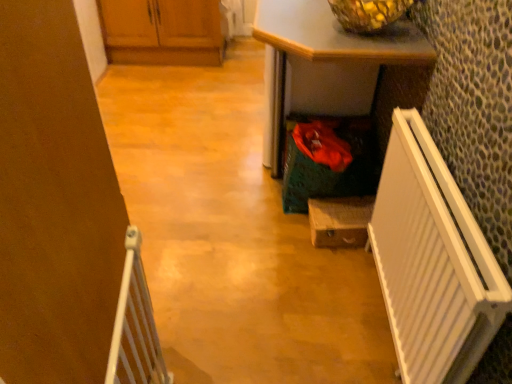
Question: Can you see wooden drawer at center, marked as the 2th cabinetry in a left-to-right arrangement, touching white plastic radiator at right, acting as the first radiator starting from the right?

Choices:
 (A) no
 (B) yes

Answer: (A)

Question: Is wooden drawer at center, which is the first cabinetry from bottom to top, bigger than white plastic radiator at right, acting as the first radiator starting from the right?

Choices:
 (A) no
 (B) yes

Answer: (A)

Question: Can you confirm if wooden drawer at center, which is counted as the 1th cabinetry, starting from the right, is thinner than white plastic radiator at right, acting as the first radiator starting from the right?

Choices:
 (A) no
 (B) yes

Answer: (A)

Question: From the image's perspective, does wooden drawer at center, which is counted as the 1th cabinetry, starting from the right, appear lower than white plastic radiator at right, the second radiator viewed from the left?

Choices:
 (A) yes
 (B) no

Answer: (B)

Question: Considering the relative sizes of wooden drawer at center, which is the first cabinetry from bottom to top, and white plastic radiator at right, the second radiator viewed from the left, in the image provided, is wooden drawer at center, which is the first cabinetry from bottom to top, shorter than white plastic radiator at right, the second radiator viewed from the left,?

Choices:
 (A) yes
 (B) no

Answer: (A)

Question: Considering the positions of wooden drawer at center, acting as the 1th cabinetry starting from the front, and green textured desk at center in the image, is wooden drawer at center, acting as the 1th cabinetry starting from the front, bigger or smaller than green textured desk at center?

Choices:
 (A) small
 (B) big

Answer: (A)

Question: Is wooden drawer at center, which is the second cabinetry in back-to-front order, to the left or to the right of green textured desk at center in the image?

Choices:
 (A) left
 (B) right

Answer: (B)

Question: Relative to green textured desk at center, is wooden drawer at center, marked as the 2th cabinetry in a left-to-right arrangement, in front or behind?

Choices:
 (A) behind
 (B) front

Answer: (A)

Question: From the image's perspective, is wooden drawer at center, which appears as the 2th cabinetry when viewed from the top, above or below green textured desk at center?

Choices:
 (A) below
 (B) above

Answer: (A)

Question: Choose the correct answer: Is wooden cabinets at upper left, which is the second cabinetry from front to back, inside green textured desk at center or outside it?

Choices:
 (A) outside
 (B) inside

Answer: (A)

Question: From the image's perspective, relative to green textured desk at center, is wooden cabinets at upper left, arranged as the 1th cabinetry when viewed from the left, above or below?

Choices:
 (A) below
 (B) above

Answer: (B)

Question: Visually, is wooden cabinets at upper left, which appears as the 2th cabinetry when viewed from the right, positioned to the left or to the right of green textured desk at center?

Choices:
 (A) left
 (B) right

Answer: (A)

Question: From a real-world perspective, relative to green textured desk at center, is wooden cabinets at upper left, marked as the 1th cabinetry in a top-to-bottom arrangement, vertically above or below?

Choices:
 (A) below
 (B) above

Answer: (A)

Question: Considering the positions of wooden cabinets at upper left, which appears as the 2th cabinetry when ordered from the bottom, and white plastic radiator at right, the second radiator viewed from the left, in the image, is wooden cabinets at upper left, which appears as the 2th cabinetry when ordered from the bottom, taller or shorter than white plastic radiator at right, the second radiator viewed from the left,?

Choices:
 (A) tall
 (B) short

Answer: (B)

Question: Looking at the image, does wooden cabinets at upper left, the 1th cabinetry when ordered from back to front, seem bigger or smaller compared to white plastic radiator at right, acting as the first radiator starting from the right?

Choices:
 (A) big
 (B) small

Answer: (A)